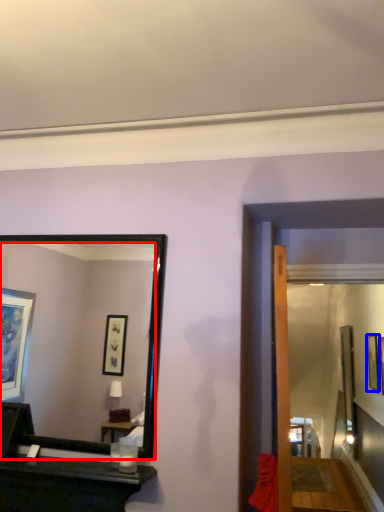
Question: Among these objects, which one is farthest to the camera, mirror (highlighted by a red box) or picture frame (highlighted by a blue box)?

Choices:
 (A) mirror
 (B) picture frame

Answer: (B)